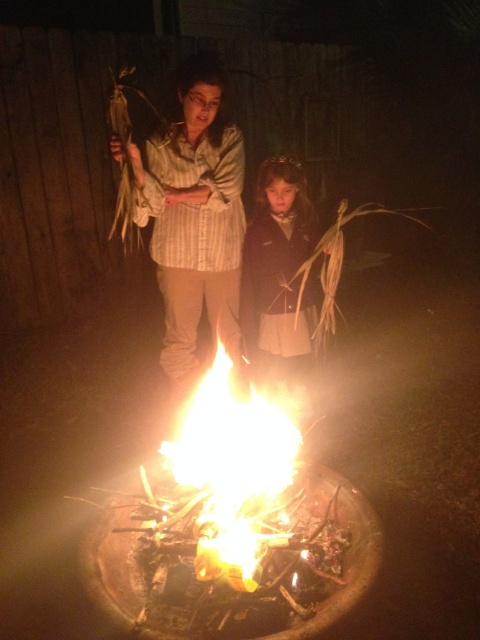
Is bright yellow-orange flames at center above dark brown wool coat at center?

Actually, bright yellow-orange flames at center is below dark brown wool coat at center.

Between point (191, 449) and point (300, 172), which one is positioned behind?

The point (300, 172) is behind.

Between point (245, 465) and point (307, 257), which one is positioned in front?

Point (245, 465) is in front.

Find the location of `bright yellow-orange flames at center`. bright yellow-orange flames at center is located at coordinates (x=231, y=461).

Can you confirm if striped cotton shirt at center is bigger than bright yellow-orange flames at center?

Yes, striped cotton shirt at center is bigger than bright yellow-orange flames at center.

Is striped cotton shirt at center positioned behind bright yellow-orange flames at center?

Yes, it is behind bright yellow-orange flames at center.

Is point (199, 67) positioned behind point (194, 474)?

Yes, it is.

This screenshot has height=640, width=480. I want to click on striped cotton shirt at center, so click(194, 218).

Between point (169, 193) and point (299, 164), which one is positioned in front?

Point (169, 193)

Between point (186, 220) and point (272, 264), which one is positioned behind?

Point (272, 264)

This screenshot has height=640, width=480. Find the location of `striped cotton shirt at center`. striped cotton shirt at center is located at coordinates (194, 218).

Where is `striped cotton shirt at center`? The width and height of the screenshot is (480, 640). striped cotton shirt at center is located at coordinates (194, 218).